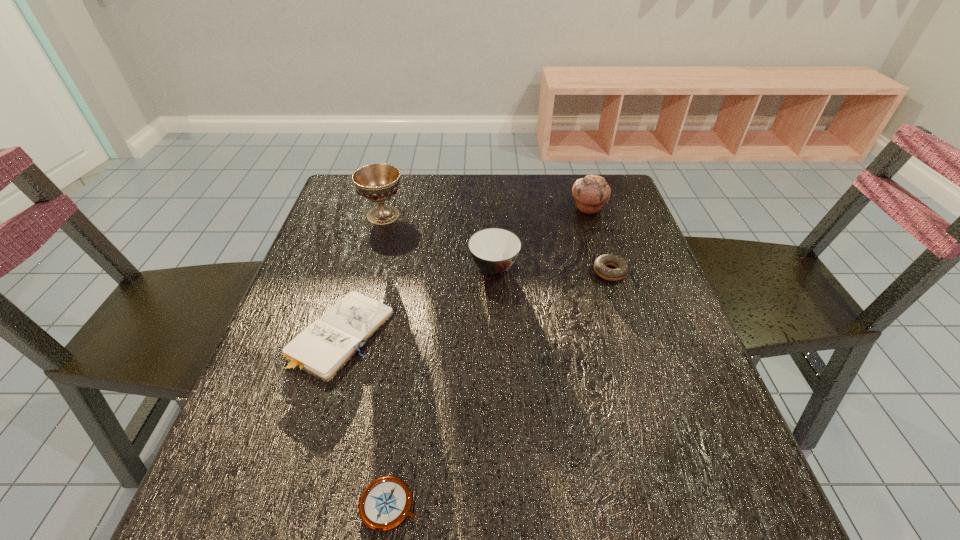
Find the location of a particular element. muffin that is positioned at the right edge is located at coordinates (591, 193).

Find the location of a particular element. This screenshot has width=960, height=540. doughnut situated at the right edge is located at coordinates (622, 268).

Locate an element on the screen. The height and width of the screenshot is (540, 960). object that is at the far left corner is located at coordinates (377, 182).

Identify the location of object that is at the far right corner. (591, 193).

Identify the location of vacant space at the far edge. The width and height of the screenshot is (960, 540). (419, 183).

Identify the location of vacant area at the left edge. (285, 450).

The width and height of the screenshot is (960, 540). Find the location of `free region at the right edge`. free region at the right edge is located at coordinates (676, 402).

I want to click on blank space at the far left corner of the desktop, so click(x=345, y=177).

This screenshot has width=960, height=540. Find the location of `free space between the shortest object and the fourth tallest object`. free space between the shortest object and the fourth tallest object is located at coordinates (500, 388).

I want to click on vacant space that's between the second tallest object and the second nearest object, so click(465, 271).